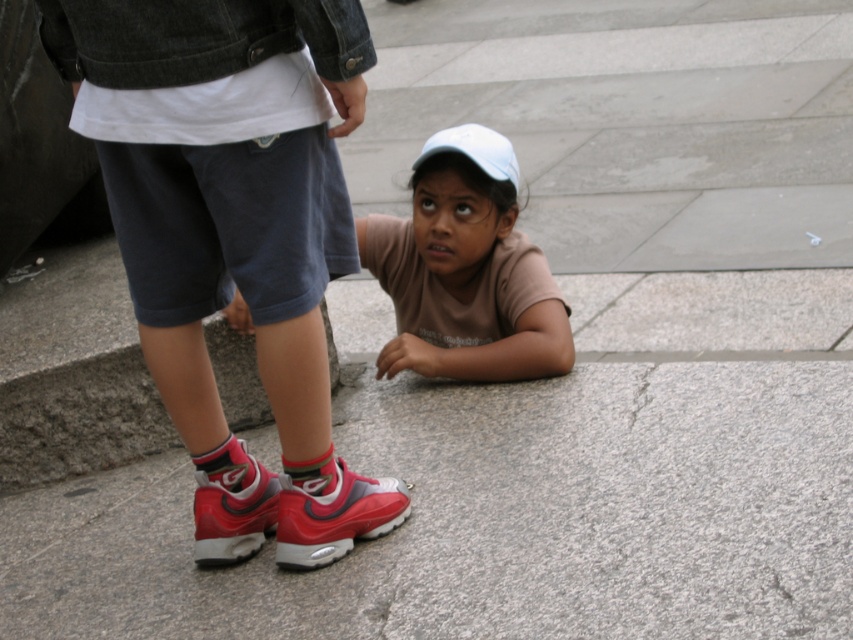
Measure the distance between matte red sneakers at lower left and camera.

A distance of 2.41 meters exists between matte red sneakers at lower left and camera.

Who is more distant from viewer, (x=325, y=284) or (x=354, y=508)?

Point (x=354, y=508)

Locate an element on the screen. This screenshot has height=640, width=853. matte red sneakers at lower left is located at coordinates (222, 182).

This screenshot has height=640, width=853. Describe the element at coordinates (231, 502) in the screenshot. I see `shiny red sneaker at lower left` at that location.

Is shiny red sneaker at lower left positioned in front of gray cotton sock at lower center?

No, it is behind gray cotton sock at lower center.

Measure the distance between shiny red sneaker at lower left and camera.

shiny red sneaker at lower left and camera are 9.64 feet apart.

Where is `shiny red sneaker at lower left`? shiny red sneaker at lower left is located at coordinates (231, 502).

Is the position of shiny red sneaker at lower center less distant than that of gray cotton sock at lower center?

Yes.

This screenshot has width=853, height=640. Find the location of `shiny red sneaker at lower center`. shiny red sneaker at lower center is located at coordinates (332, 509).

Which is in front, point (283, 493) or point (318, 458)?

Point (318, 458) is in front.

I want to click on shiny red sneaker at lower center, so click(x=332, y=509).